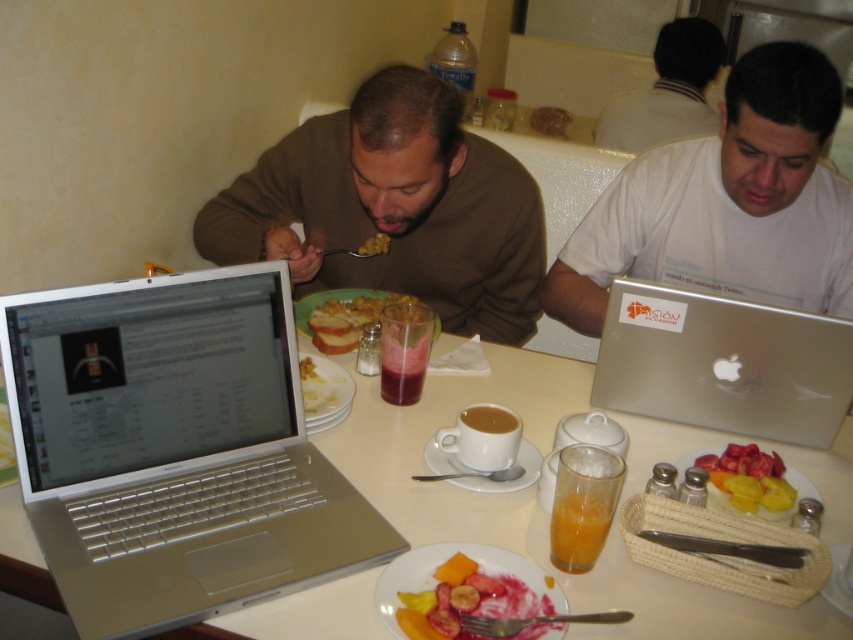
Question: Does white matte laptop at center appear over yellow matte corn at center?

Choices:
 (A) no
 (B) yes

Answer: (B)

Question: Which of the following is the closest to the observer?

Choices:
 (A) (614, 109)
 (B) (317, 406)
 (C) (775, 301)
 (D) (492, 611)

Answer: (D)

Question: Among these objects, which one is nearest to the camera?

Choices:
 (A) silver metallic laptop at center
 (B) smooth yellow fruit at center
 (C) yellowish matte bread at center

Answer: (A)

Question: Is translucent glass of orange juice at center closer to the viewer compared to matte plastic toast at center?

Choices:
 (A) yes
 (B) no

Answer: (A)

Question: Is silver metallic laptop at center further to the viewer compared to light brown shirt at upper center?

Choices:
 (A) yes
 (B) no

Answer: (B)

Question: Which point is closer to the camera?

Choices:
 (A) (315, 364)
 (B) (554, 541)
 (C) (120, 326)
 (D) (383, 595)

Answer: (D)